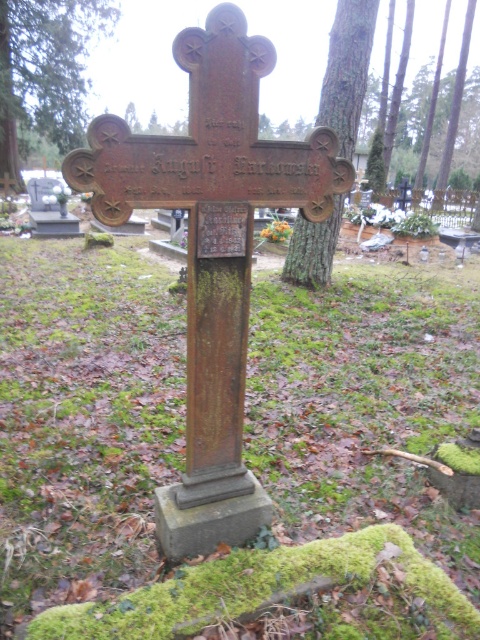
You are a gardener tasked with trimming trees in a cemetery. You notice the green mossy tree at upper left and the smooth bark tree trunk at center. Which tree requires more attention due to its size? Please provide your reasoning based on the scene description.

The green mossy tree at upper left requires more attention because it has a larger size compared to the smooth bark tree trunk at center, making it potentially obstructive or in need of maintenance.

You are standing in front of the gravestone and want to place a wreath at one of the two points marked on the gravestone. Which point, point [299,243] or point [386,84], is closer to you where you can place the wreath easily?

Point [299,243] is closer to the viewer than point [386,84], so you can place the wreath easily at point [299,243].